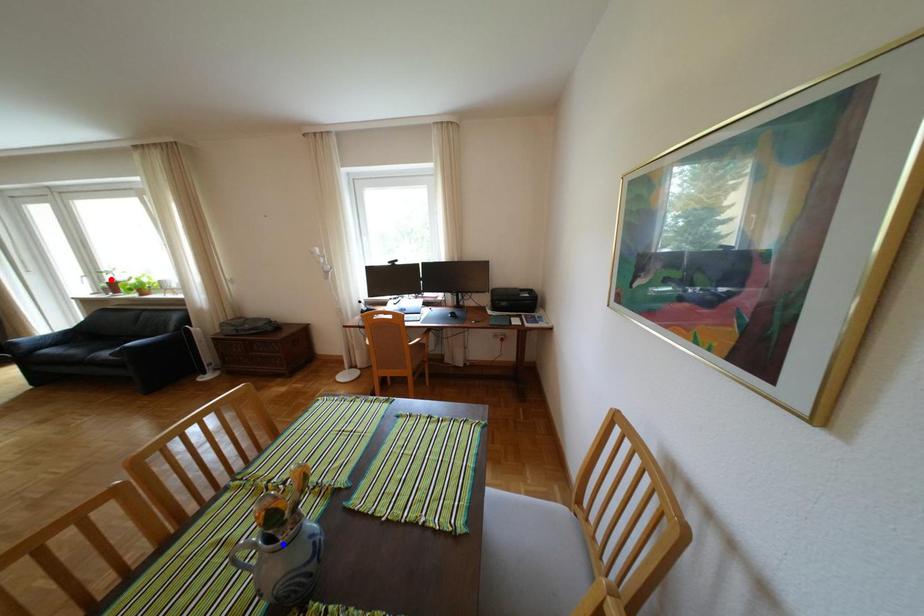
Question: Which of the two points in the image is closer to the camera?

Choices:
 (A) Blue point is closer.
 (B) Red point is closer.

Answer: (A)